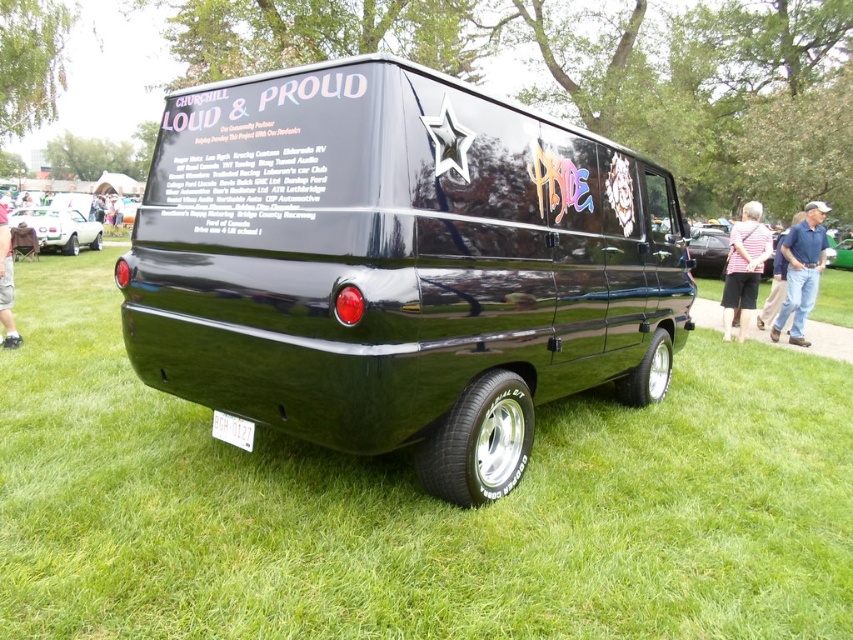
You are a photographer at an outdoor event and see a striped shirt at right and a matte white car at left in your frame. Which object is positioned lower in the scene?

The striped shirt at right is located below the matte white car at left, so it is positioned lower in the scene.

You are at an outdoor event and see the black van with the text. You need to take a photo of the van. Which object, the striped shirt at right or the matte white car at left, should you avoid blocking to ensure the van is fully visible in your photo?

The striped shirt at right has a smaller size compared to matte white car at left, so you should avoid blocking the matte white car at left as it is larger and might obstruct the van more significantly.

You are standing near the black van and see the matte white car at left and the skinny jeans at lower left. Which object is positioned more to the left side of the scene?

The matte white car at left is positioned more to the left side of the scene than the skinny jeans at lower left.